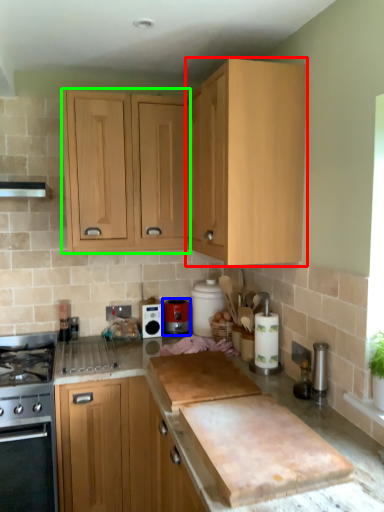
Question: Which is nearer to the cabinetry (highlighted by a red box)? kitchen appliance (highlighted by a blue box) or cabinetry (highlighted by a green box).

Choices:
 (A) kitchen appliance
 (B) cabinetry

Answer: (B)